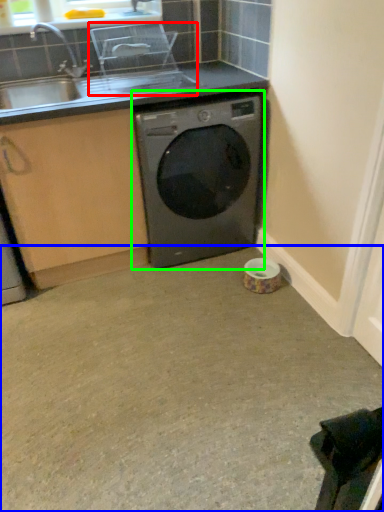
Question: Which object is the farthest from appliance (highlighted by a red box)? Choose among these: concrete (highlighted by a blue box) or washing machine (highlighted by a green box).

Choices:
 (A) concrete
 (B) washing machine

Answer: (A)